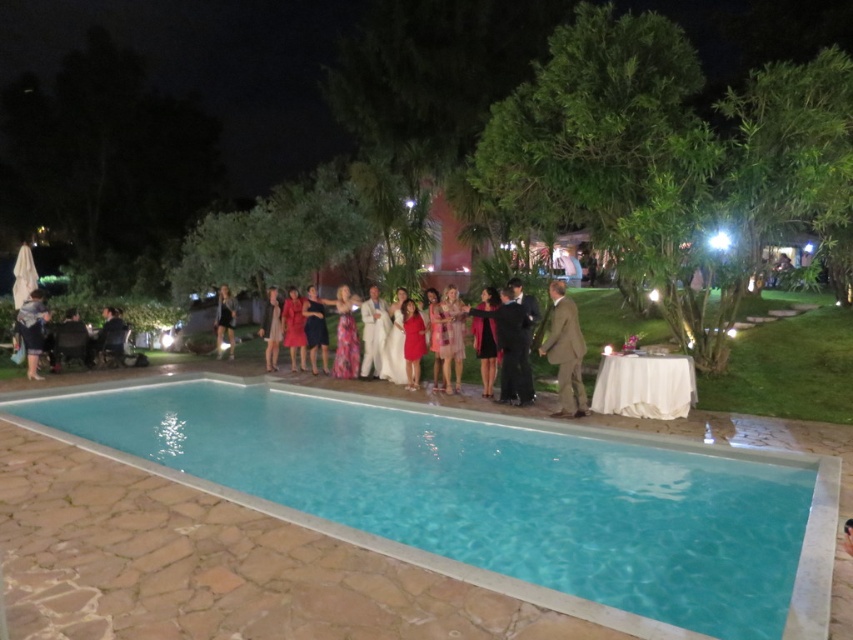
You are a photographer trying to capture a group photo of the people at the pool. You notice the clear blue water at center and the satin brown suit at center. Which object is shorter in height?

The clear blue water at center has a lesser height compared to the satin brown suit at center, so the clear blue water at center is shorter in height.

You are a photographer at the event and need to adjust the camera settings to ensure both the denim jacket at lower left and the shiny black dress at center are clearly visible. Which object requires a wider aperture setting to capture its details due to its size?

The denim jacket at lower left requires a wider aperture setting because its width surpasses that of the shiny black dress at center, necessitating a larger aperture to capture its details effectively.